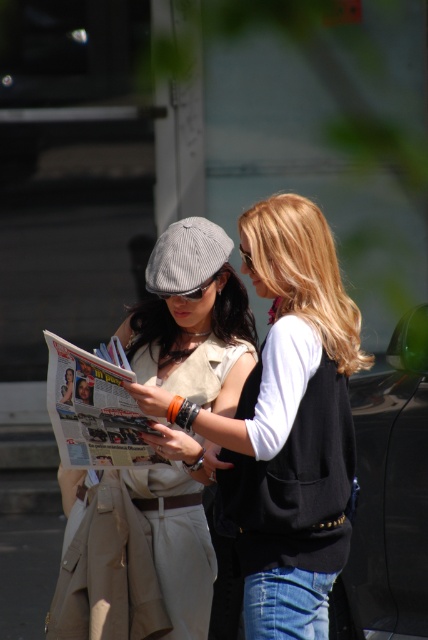
You are a photographer adjusting the focus on your camera. The matte beige trench coat at left is in focus, but the black plastic goggles at upper center are slightly out of focus. To bring both into sharp focus, what adjustment should you make to the camera settings?

To bring both the matte beige trench coat at left and the black plastic goggles at upper center into sharp focus, you should increase the depth of field by adjusting the aperture to a smaller opening. This will ensure that objects at different distances from the camera are in focus.

You are a fashion designer observing two people in a photo. You need to determine which item is wider between the matte beige trench coat at left and the black plastic goggles at upper center. Which one is wider?

The matte beige trench coat at left is wider than the black plastic goggles at upper center.